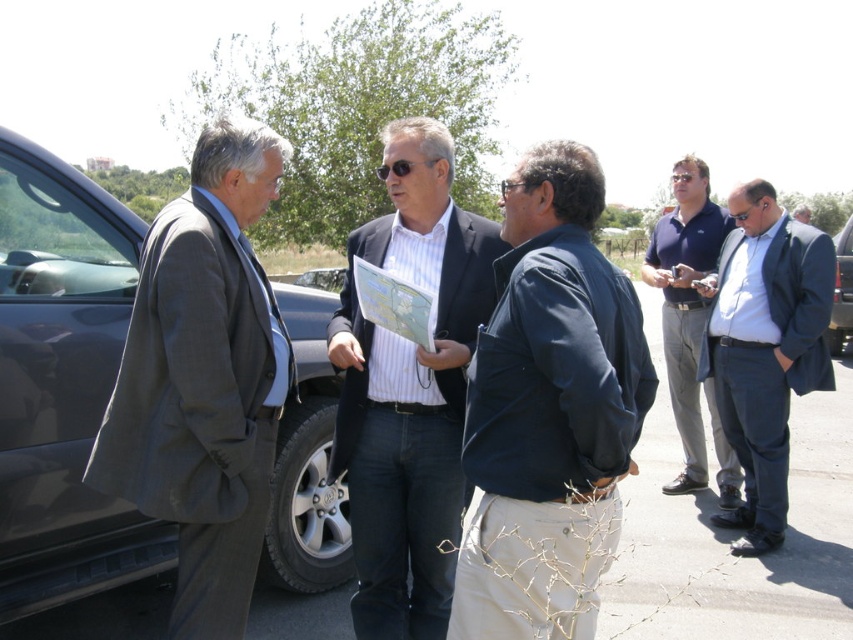
Which is in front, point (555, 291) or point (192, 428)?

Point (555, 291) is in front.

Does point (569, 230) lie in front of point (247, 220)?

Yes, it is.

Image resolution: width=853 pixels, height=640 pixels. In order to click on dark blue jacket at center in this screenshot , I will do `click(549, 410)`.

Is matte black suit at center thinner than dark blue suit at right?

No, matte black suit at center is not thinner than dark blue suit at right.

Can you confirm if matte black suit at center is smaller than dark blue suit at right?

Correct, matte black suit at center occupies less space than dark blue suit at right.

Where is `matte black suit at center`? The width and height of the screenshot is (853, 640). matte black suit at center is located at coordinates (409, 388).

You are a GUI agent. You are given a task and a screenshot of the screen. Output one action in this format:
    pyautogui.click(x=<x>, y=<y>)
    Task: Click on the dark blue polo shirt at right
    
    Given the screenshot: What is the action you would take?
    pyautogui.click(x=685, y=301)